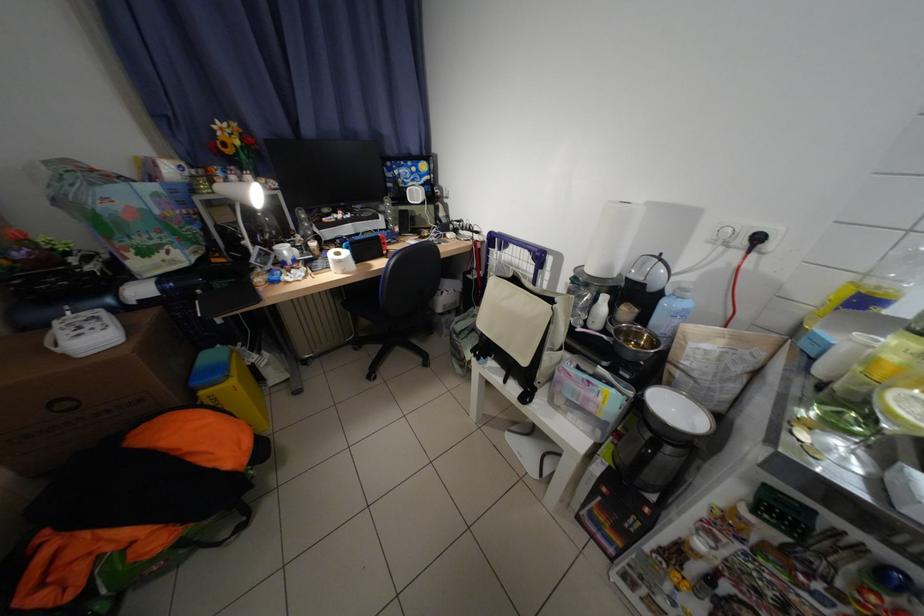
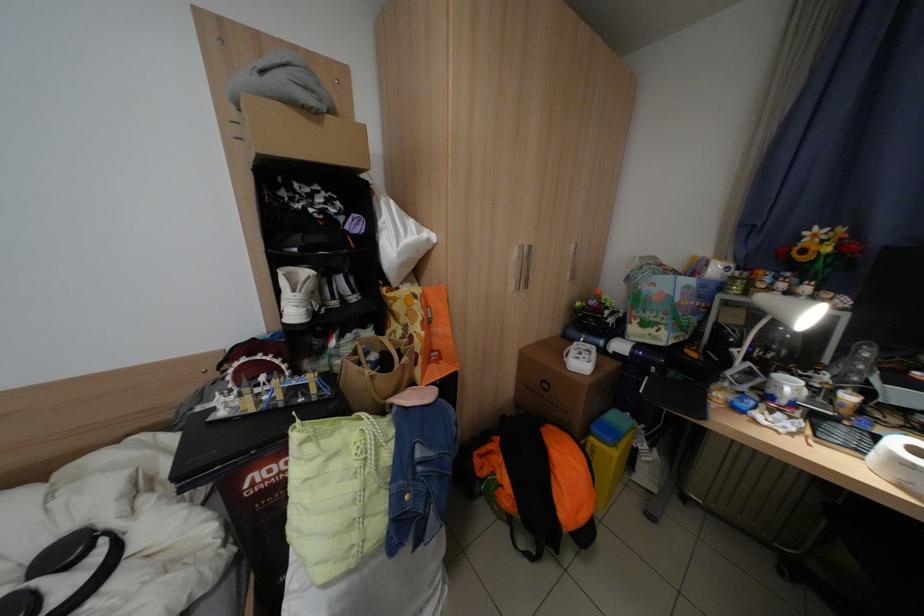
The point at (207, 385) is marked in the first image. Where is the corresponding point in the second image?

(604, 430)